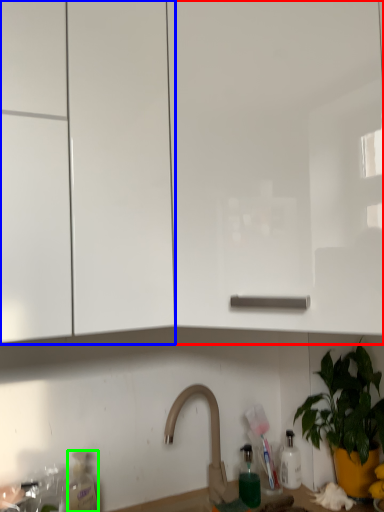
Question: Which object is the closest to the cabinetry (highlighted by a red box)? Choose among these: cabinetry (highlighted by a blue box) or bottle (highlighted by a green box).

Choices:
 (A) cabinetry
 (B) bottle

Answer: (A)